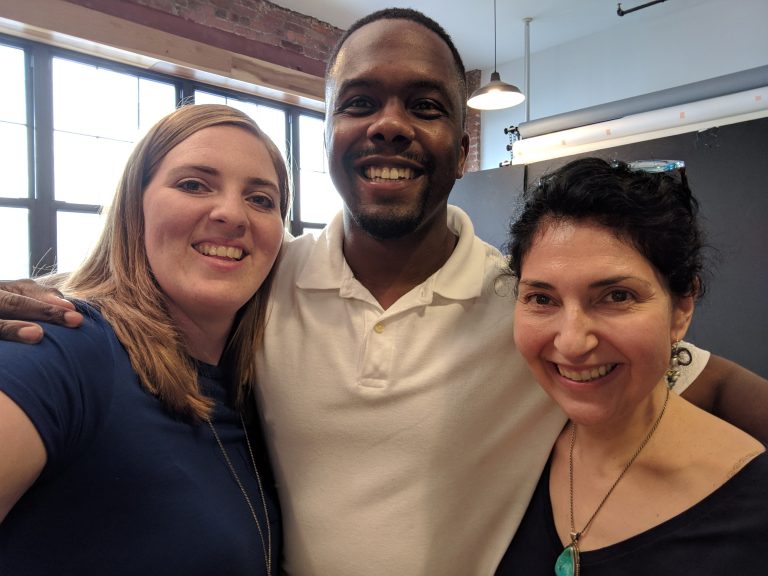
The image size is (768, 576). I want to click on ceiling, so click(481, 34).